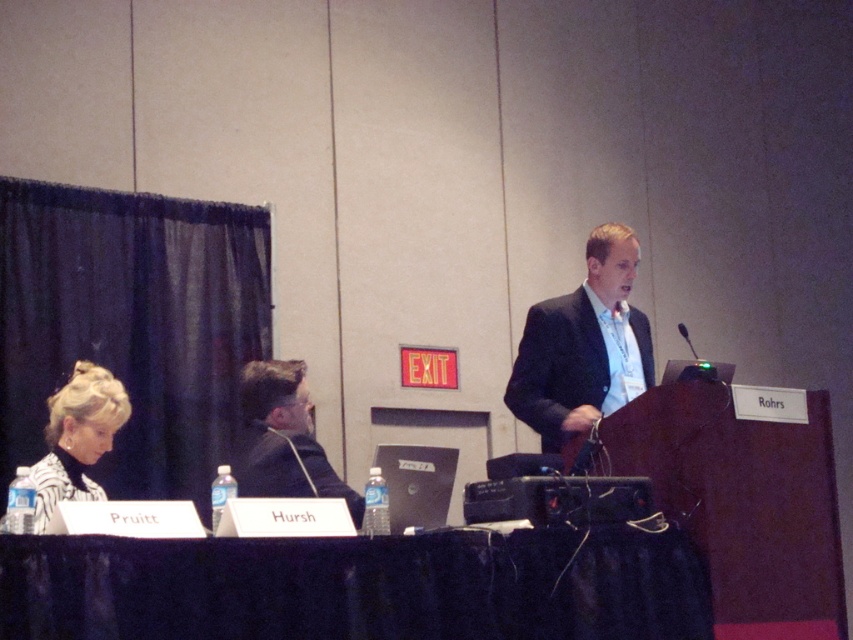
Question: Does black fabric table at lower center come behind black plastic microphone at upper center?

Choices:
 (A) no
 (B) yes

Answer: (A)

Question: Estimate the real-world distances between objects in this image. Which object is farther from the striped fabric hair at upper left?

Choices:
 (A) black plastic microphone at upper center
 (B) matte black suit at center
 (C) dark suit at center
 (D) black fabric table at lower center

Answer: (A)

Question: Is dark suit at center bigger than striped fabric hair at upper left?

Choices:
 (A) yes
 (B) no

Answer: (A)

Question: Can you confirm if matte black suit at center is wider than striped fabric hair at upper left?

Choices:
 (A) yes
 (B) no

Answer: (A)

Question: Based on their relative distances, which object is farther from the striped fabric hair at upper left?

Choices:
 (A) matte black suit at center
 (B) dark suit at center

Answer: (A)

Question: Which point is farther to the camera?

Choices:
 (A) (618, 292)
 (B) (688, 340)

Answer: (B)